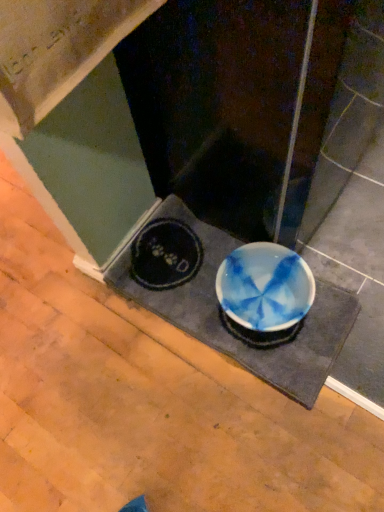
The image size is (384, 512). I want to click on free spot below blue glossy bowl at center (from a real-world perspective), so click(x=211, y=287).